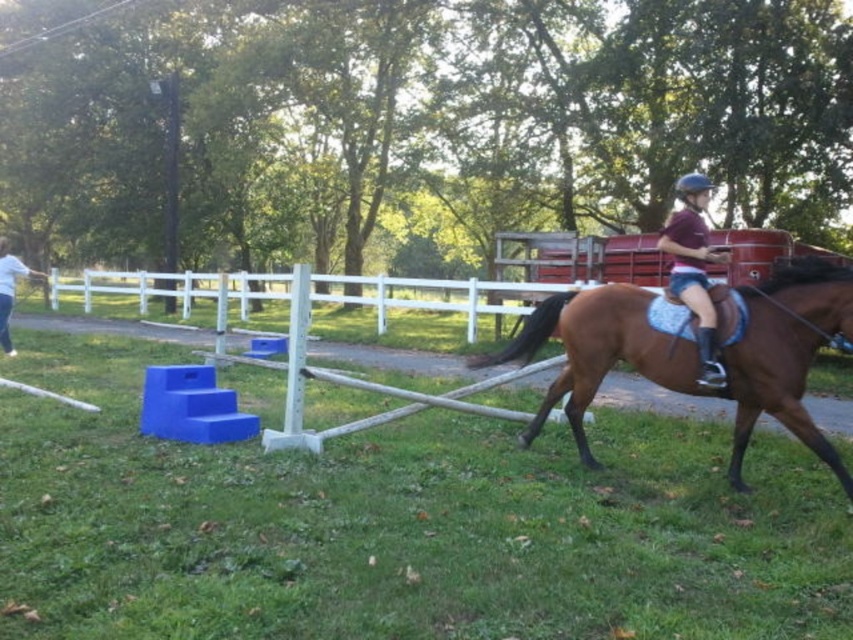
Is brown glossy horse at right shorter than white cotton shirt at left?

Yes.

Is brown glossy horse at right thinner than white cotton shirt at left?

Yes, brown glossy horse at right is thinner than white cotton shirt at left.

Does point (750, 292) lie in front of point (4, 307)?

Yes, point (750, 292) is closer to viewer.

The width and height of the screenshot is (853, 640). I want to click on brown glossy horse at right, so click(x=695, y=353).

Can you confirm if maroon jersey at center is thinner than white cotton shirt at left?

Correct, maroon jersey at center's width is less than white cotton shirt at left's.

Where is `maroon jersey at center`? The image size is (853, 640). maroon jersey at center is located at coordinates (694, 269).

Which is behind, point (695, 230) or point (3, 332)?

The point (3, 332) is behind.

I want to click on maroon jersey at center, so click(x=694, y=269).

Is white vinyl fence at center shorter than white cotton shirt at left?

Yes, white vinyl fence at center is shorter than white cotton shirt at left.

The image size is (853, 640). Identify the location of white vinyl fence at center. (425, 296).

Locate an element on the screen. white vinyl fence at center is located at coordinates click(425, 296).